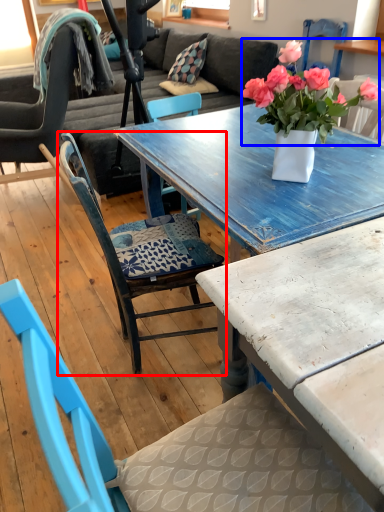
Question: Which point is closer to the camera, chair (highlighted by a red box) or flower (highlighted by a blue box)?

Choices:
 (A) chair
 (B) flower

Answer: (B)